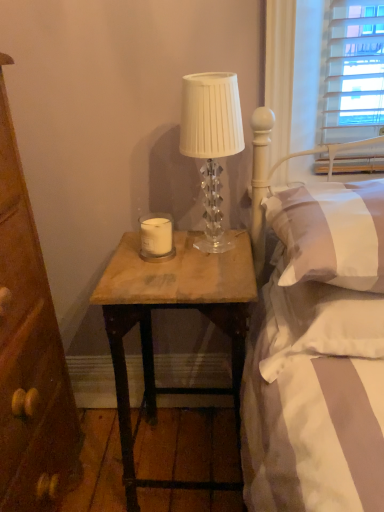
Find the location of a particular element. This screenshot has width=384, height=512. vacant area to the left of clear crystal lamp at upper center is located at coordinates (157, 262).